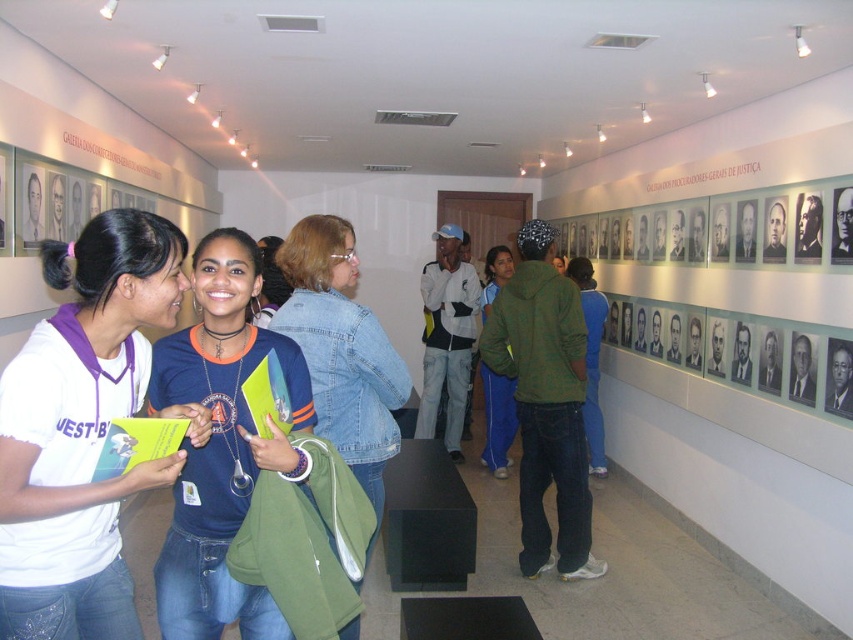
Can you confirm if white matte t-shirt at center is bigger than blue denim jacket at center?

Correct, white matte t-shirt at center is larger in size than blue denim jacket at center.

Can you confirm if white matte t-shirt at center is smaller than blue denim jacket at center?

No, white matte t-shirt at center is not smaller than blue denim jacket at center.

Does point (33, 616) come in front of point (247, 237)?

That is True.

The image size is (853, 640). What are the coordinates of `white matte t-shirt at center` in the screenshot? It's located at (80, 429).

Who is more distant from viewer, (x=161, y=596) or (x=366, y=490)?

Point (x=366, y=490)

Between blue denim jacket at center and denim jacket at center, which one appears on the right side from the viewer's perspective?

Positioned to the right is denim jacket at center.

Is point (202, 292) positioned in front of point (316, 337)?

Yes, point (202, 292) is in front of point (316, 337).

In order to click on blue denim jacket at center in this screenshot , I will do `click(221, 444)`.

Who is more forward, (289,372) or (509,264)?

Point (289,372) is more forward.

Can you confirm if blue denim jacket at center is positioned above blue denim jeans at center?

Yes.

Locate an element on the screen. blue denim jacket at center is located at coordinates (221, 444).

Where is `blue denim jacket at center`? The image size is (853, 640). blue denim jacket at center is located at coordinates (221, 444).